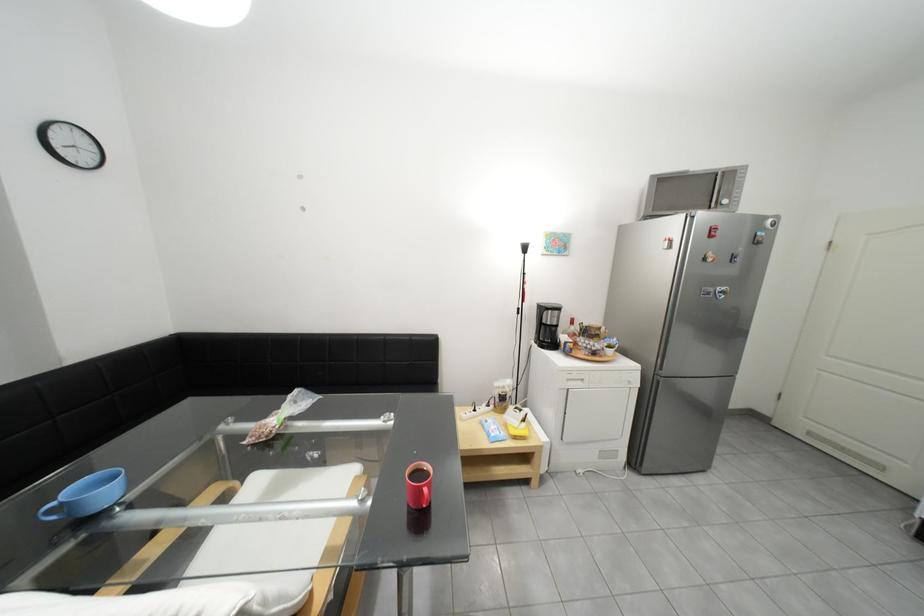
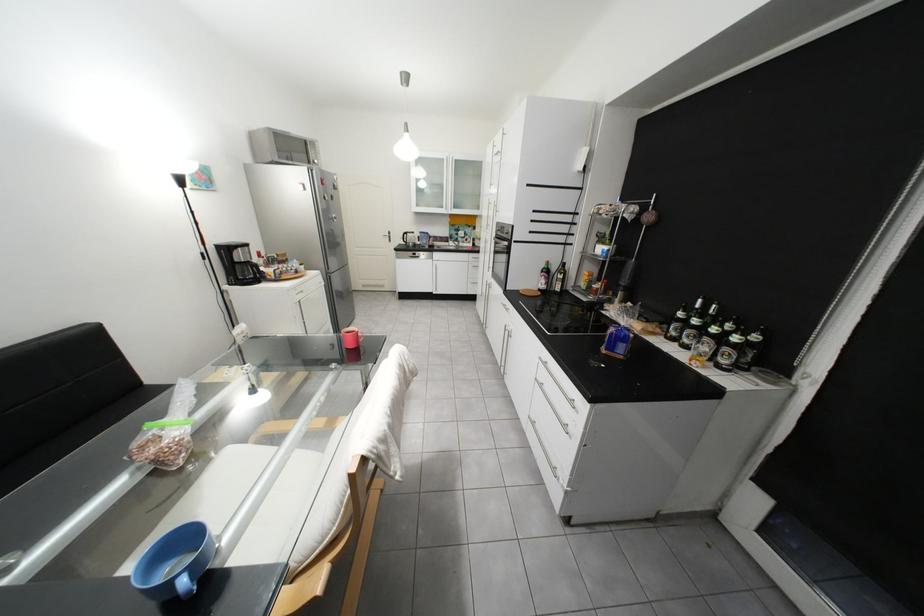
The point at (635, 458) is marked in the first image. Where is the corresponding point in the second image?

(343, 331)